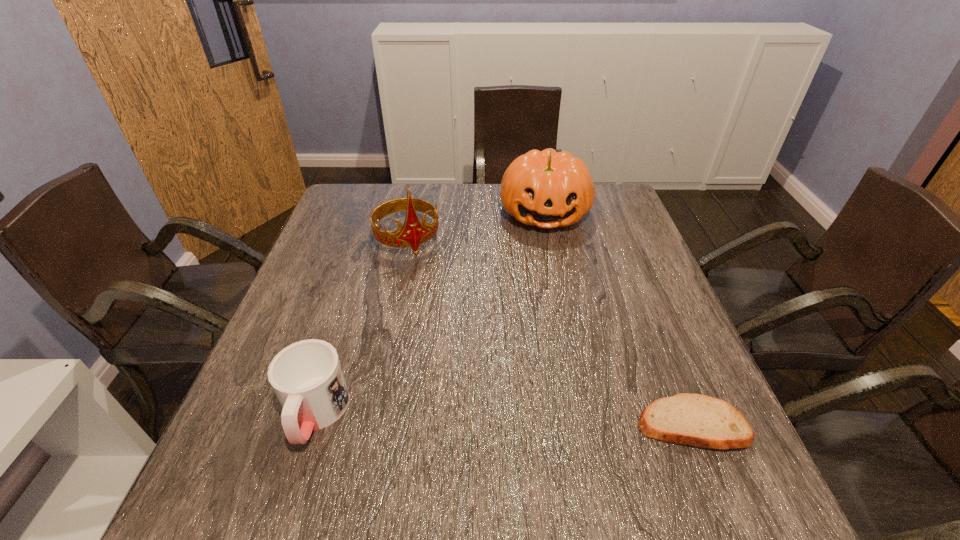
This screenshot has height=540, width=960. What are the coordinates of `mug` in the screenshot? It's located at (307, 378).

The width and height of the screenshot is (960, 540). Identify the location of pita bread. (692, 419).

Find the location of a particular element. The width and height of the screenshot is (960, 540). tiara is located at coordinates (413, 233).

Image resolution: width=960 pixels, height=540 pixels. I want to click on pumpkin, so click(549, 189).

You are a GUI agent. You are given a task and a screenshot of the screen. Output one action in this format:
    pyautogui.click(x=<x>, y=<y>)
    Task: Click on the free space located on the back of the shortest object
    The image size is (960, 540).
    Given the screenshot: What is the action you would take?
    pyautogui.click(x=638, y=288)

At what (x,y) coordinates should I click in order to perform the action: click on vacant position located on the front-facing side of the tiara. Please return your answer as a coordinate pair (x, y). Image resolution: width=960 pixels, height=540 pixels. Looking at the image, I should click on (431, 291).

The width and height of the screenshot is (960, 540). What are the coordinates of `free space located on the front-facing side of the tiara` in the screenshot? It's located at (438, 303).

This screenshot has height=540, width=960. I want to click on free spot located 0.240m on the front-facing side of the tiara, so click(x=445, y=320).

In order to click on vacant space located 0.060m on the carved face of the pumpkin in this screenshot , I will do `click(547, 252)`.

Locate an element on the screen. This screenshot has width=960, height=540. vacant point located 0.120m on the carved face of the pumpkin is located at coordinates (548, 266).